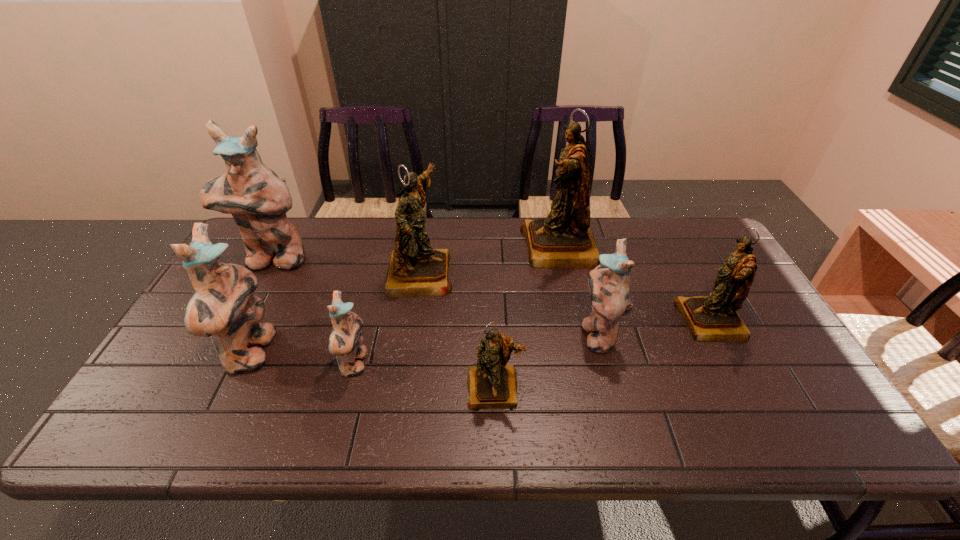
Where is `vacant region located 0.330m on the front-facing side of the biggest pink figurine`? The height and width of the screenshot is (540, 960). vacant region located 0.330m on the front-facing side of the biggest pink figurine is located at coordinates (217, 362).

I want to click on vacant point located on the front-facing side of the biggest gold figurine, so click(498, 248).

You are a GUI agent. You are given a task and a screenshot of the screen. Output one action in this format:
    pyautogui.click(x=<x>, y=<y>)
    Task: Click on the blank space located 0.290m on the front-facing side of the biggest gold figurine
    
    Given the screenshot: What is the action you would take?
    pyautogui.click(x=434, y=248)

Find the location of a particular element. The height and width of the screenshot is (540, 960). vacant area situated on the front-facing side of the biggest gold figurine is located at coordinates (489, 248).

Locate an element on the screen. The image size is (960, 540). free space located on the front-facing side of the third smallest gold figurine is located at coordinates (566, 272).

The width and height of the screenshot is (960, 540). Find the location of `vacant space situated on the front-facing side of the third smallest pink figurine`. vacant space situated on the front-facing side of the third smallest pink figurine is located at coordinates (376, 353).

Find the location of `free region located 0.400m on the front-facing side of the rightmost figurine`. free region located 0.400m on the front-facing side of the rightmost figurine is located at coordinates (535, 322).

I want to click on vacant region located on the front-facing side of the rightmost figurine, so click(x=604, y=322).

Locate an element on the screen. This screenshot has width=960, height=540. free spot located 0.100m on the front-facing side of the rightmost figurine is located at coordinates (644, 322).

You are a GUI agent. You are given a task and a screenshot of the screen. Output one action in this format:
    pyautogui.click(x=<x>, y=<y>)
    Task: Click on the free region located on the front-facing side of the third biggest pink figurine
    This screenshot has height=540, width=960.
    Given the screenshot: What is the action you would take?
    pyautogui.click(x=490, y=334)